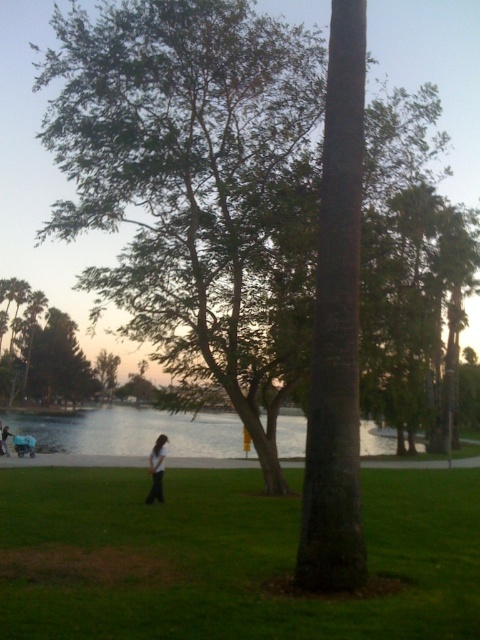
Between green grass at center and light brown hair at center, which one appears on the right side from the viewer's perspective?

green grass at center

Is green grass at center below light brown hair at center?

No, green grass at center is not below light brown hair at center.

Does point (224, 484) come in front of point (160, 452)?

That is False.

Find the location of a particular element. green grass at center is located at coordinates (226, 556).

Which is more to the left, clear water at center or light brown hair at center?

clear water at center

Is the position of clear water at center more distant than that of light brown hair at center?

Yes, it is.

Measure the distance between point (70, 435) and camera.

Point (70, 435) and camera are 62.91 meters apart from each other.

The height and width of the screenshot is (640, 480). What are the coordinates of `clear water at center` in the screenshot? It's located at (132, 432).

Which is in front, point (134, 435) or point (1, 442)?

Positioned in front is point (1, 442).

Can you confirm if clear water at center is thinner than dark blue jeans at center?

No.

Who is more distant from viewer, (96, 452) or (6, 433)?

Positioned behind is point (96, 452).

Where is `clear water at center`? clear water at center is located at coordinates (132, 432).